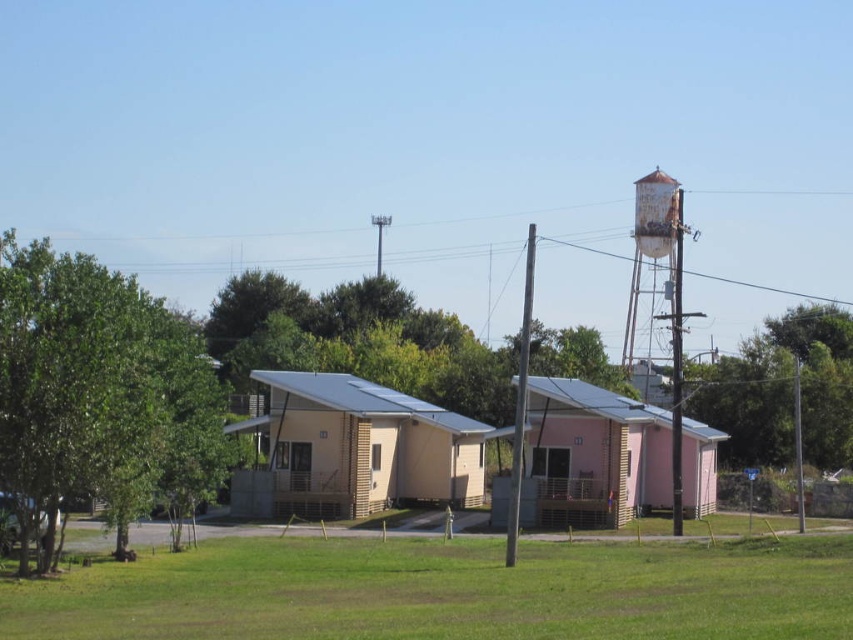
Question: Can you confirm if pink wood house at center is positioned above green leafy tree at right?

Choices:
 (A) no
 (B) yes

Answer: (A)

Question: Is green leafy tree at left to the left of green leafy tree at right from the viewer's perspective?

Choices:
 (A) no
 (B) yes

Answer: (B)

Question: Which object is farther from the camera taking this photo?

Choices:
 (A) green leafy tree at left
 (B) pink wood house at center

Answer: (B)

Question: Which object is farther from the camera taking this photo?

Choices:
 (A) pink wood house at center
 (B) rusty metal water tower at upper right
 (C) green leafy tree at right
 (D) green leafy tree at left

Answer: (C)

Question: Which object is the farthest from the green leafy tree at left?

Choices:
 (A) rusty metal water tower at upper right
 (B) pink wood house at center
 (C) green leafy tree at right
 (D) beige wood cabin at center

Answer: (C)

Question: Is beige wood cabin at center further to camera compared to pink wood house at center?

Choices:
 (A) no
 (B) yes

Answer: (B)